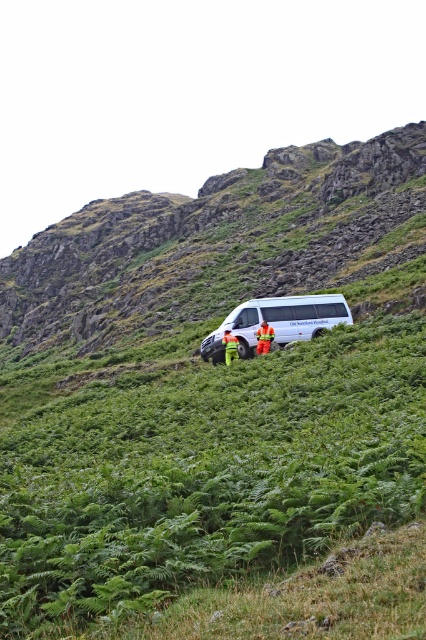
Based on the photo, you are a hiker who has just arrived at the scene. You see the green leafy grass at center and the white matte van at center. Which object is closer to you as you approach from the direction of the mountain trail?

The green leafy grass at center is closer to you because it is in front of the white matte van at center, meaning it is nearer to your position as you approach from the mountain trail.